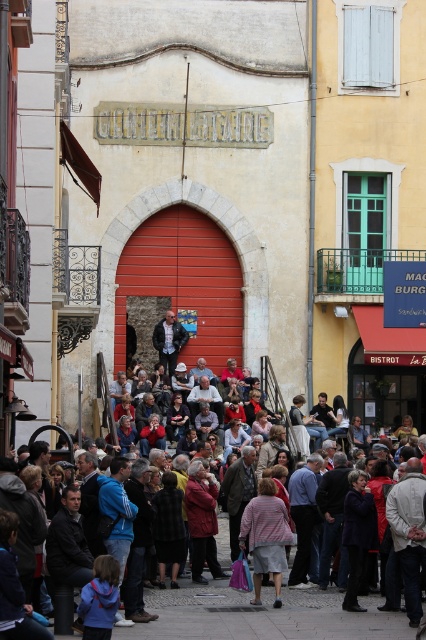
Question: Does striped fabric skirt at center have a larger size compared to black checkered jacket at center?

Choices:
 (A) yes
 (B) no

Answer: (A)

Question: Which point is farther from the camera taking this photo?

Choices:
 (A) (353, 522)
 (B) (249, 547)
 (C) (172, 474)
 (D) (77, 573)

Answer: (C)

Question: Does multicolored clothing at center appear over red wool coat at center?

Choices:
 (A) no
 (B) yes

Answer: (A)

Question: Which object appears farthest from the camera in this image?

Choices:
 (A) multicolored clothing at center
 (B) black checkered jacket at center
 (C) red wool coat at center
 (D) striped fabric skirt at center

Answer: (C)

Question: Based on their relative distances, which object is nearer to the black checkered jacket at center?

Choices:
 (A) multicolored clothing at center
 (B) striped fabric skirt at center
 (C) dark blue fabric coat at center

Answer: (A)

Question: Can you confirm if dark blue fabric coat at center is smaller than black checkered jacket at center?

Choices:
 (A) yes
 (B) no

Answer: (B)